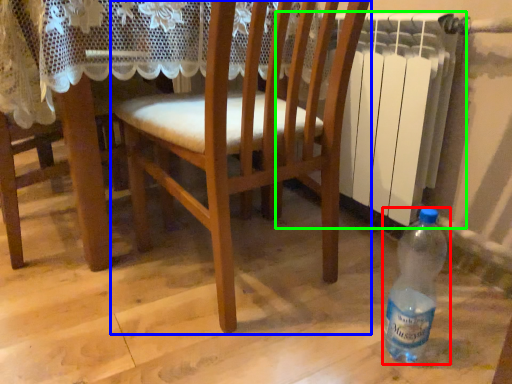
Question: Estimate the real-world distances between objects in this image. Which object is farther from bottle (highlighted by a red box), chair (highlighted by a blue box) or radiator (highlighted by a green box)?

Choices:
 (A) chair
 (B) radiator

Answer: (B)